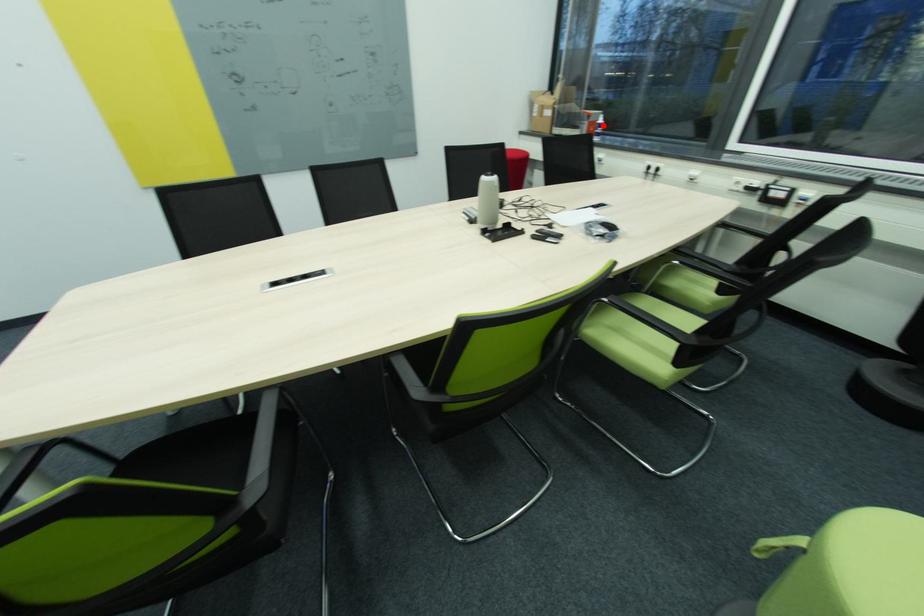
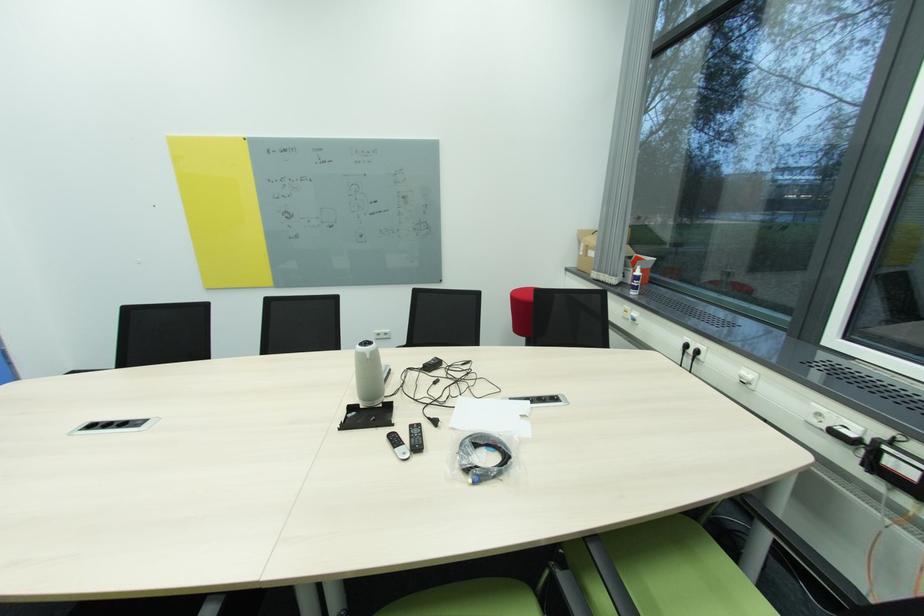
Locate, in the second image, the point that corresponds to the highlighted location in the first image.

(639, 277)